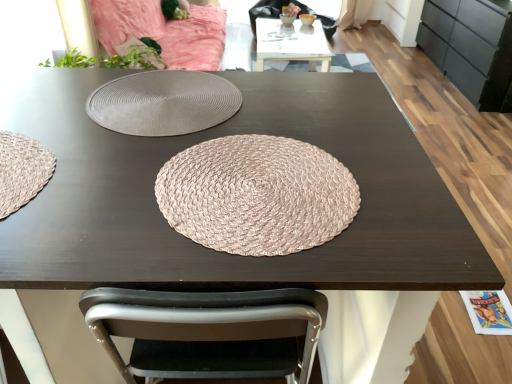
Locate an element on the screen. vacant area to the right of pink woven mat at center is located at coordinates (401, 191).